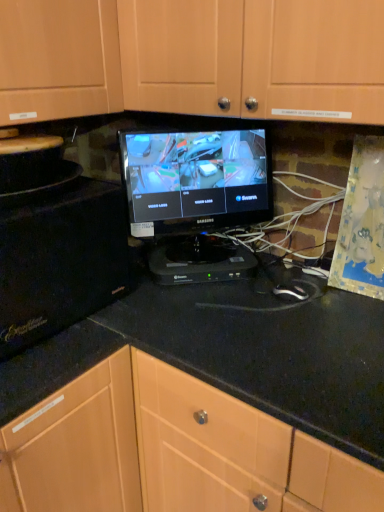
Question: Can you confirm if black glossy monitor at center is thinner than black matte microwave at left, arranged as the second appliance when viewed from the right?

Choices:
 (A) yes
 (B) no

Answer: (A)

Question: Considering the relative sizes of black glossy monitor at center and black matte microwave at left, the first appliance in the left-to-right sequence, in the image provided, is black glossy monitor at center shorter than black matte microwave at left, the first appliance in the left-to-right sequence,?

Choices:
 (A) yes
 (B) no

Answer: (B)

Question: From the image's perspective, does black glossy monitor at center appear higher than black matte microwave at left, the first appliance in the left-to-right sequence?

Choices:
 (A) no
 (B) yes

Answer: (B)

Question: Does black glossy monitor at center come behind black matte microwave at left, the first appliance in the left-to-right sequence?

Choices:
 (A) yes
 (B) no

Answer: (A)

Question: From a real-world perspective, is black glossy monitor at center located beneath black matte microwave at left, arranged as the second appliance when viewed from the right?

Choices:
 (A) yes
 (B) no

Answer: (B)

Question: Is black glossy monitor at center next to black matte microwave at left, arranged as the second appliance when viewed from the right, and touching it?

Choices:
 (A) yes
 (B) no

Answer: (B)

Question: Can black plastic device at center, which is the first appliance in right-to-left order, be found inside black plastic mouse at center?

Choices:
 (A) no
 (B) yes

Answer: (A)

Question: Considering the relative positions of black plastic mouse at center and black plastic device at center, which is the first appliance in right-to-left order, in the image provided, is black plastic mouse at center to the left of black plastic device at center, which is the first appliance in right-to-left order, from the viewer's perspective?

Choices:
 (A) yes
 (B) no

Answer: (B)

Question: Is black plastic mouse at center wider than black plastic device at center, arranged as the 2th appliance when viewed from the left?

Choices:
 (A) yes
 (B) no

Answer: (B)

Question: From a real-world perspective, does black plastic mouse at center sit lower than black plastic device at center, which is the first appliance in right-to-left order?

Choices:
 (A) yes
 (B) no

Answer: (A)

Question: Does black plastic mouse at center have a lesser height compared to black plastic device at center, arranged as the 2th appliance when viewed from the left?

Choices:
 (A) no
 (B) yes

Answer: (B)

Question: Considering the relative positions of black plastic mouse at center and black plastic device at center, arranged as the 2th appliance when viewed from the left, in the image provided, is black plastic mouse at center behind black plastic device at center, arranged as the 2th appliance when viewed from the left,?

Choices:
 (A) yes
 (B) no

Answer: (B)

Question: From a real-world perspective, is black granite countertop at center on top of black glossy monitor at center?

Choices:
 (A) no
 (B) yes

Answer: (A)